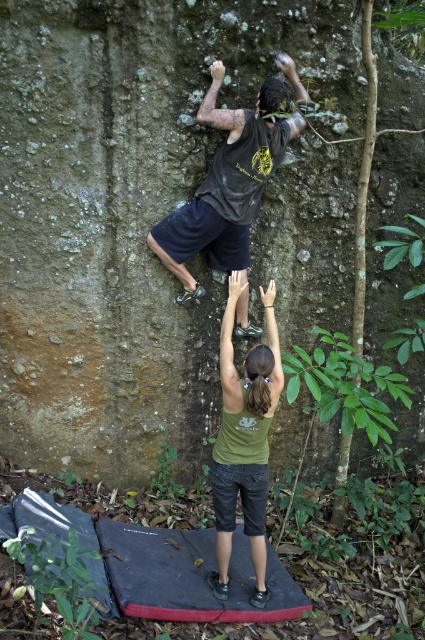
You are a photographer trying to capture a climber on a rock face. You have a camera and a black matte shirt at upper center. If you want to adjust your camera to focus on the climber, which object should you move closer to the climber?

You should move the camera closer to the climber because the black matte shirt at upper center and camera are 3.37 meters apart from each other, so moving the camera closer would help focus on the climber.

Based on the photo, you are a photographer trying to capture the climber and the woman on the crash pad in a single shot. Given the coordinates of the black matte shirt at upper center, which corresponds to point (226, 186), what is the position of the woman relative to the climber?

The black matte shirt at upper center is represented by point (226, 186), so the woman is positioned at the upper center relative to the climber.

You are a photographer positioned at the origin point of the image. You want to capture a photo of the black matte shirt at upper center. According to the coordinates provided in the Objects Description, in which direction should you move your camera to frame the shirt properly?

The black matte shirt at upper center is located at point 0.291 on the x and 0.534 on the y. Since the origin is typically the bottom left corner in image coordinates, moving the camera to the right and slightly up would position the shirt in the frame.